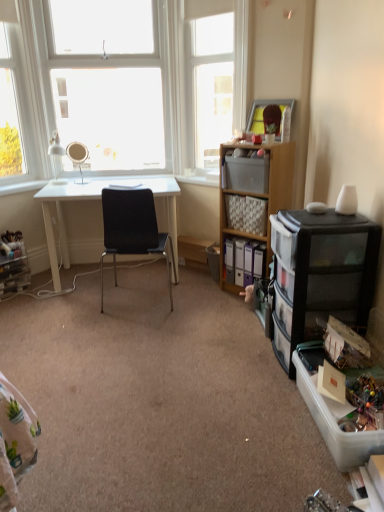
The image size is (384, 512). I want to click on free space that is to the left of black mesh chair at center, so click(57, 313).